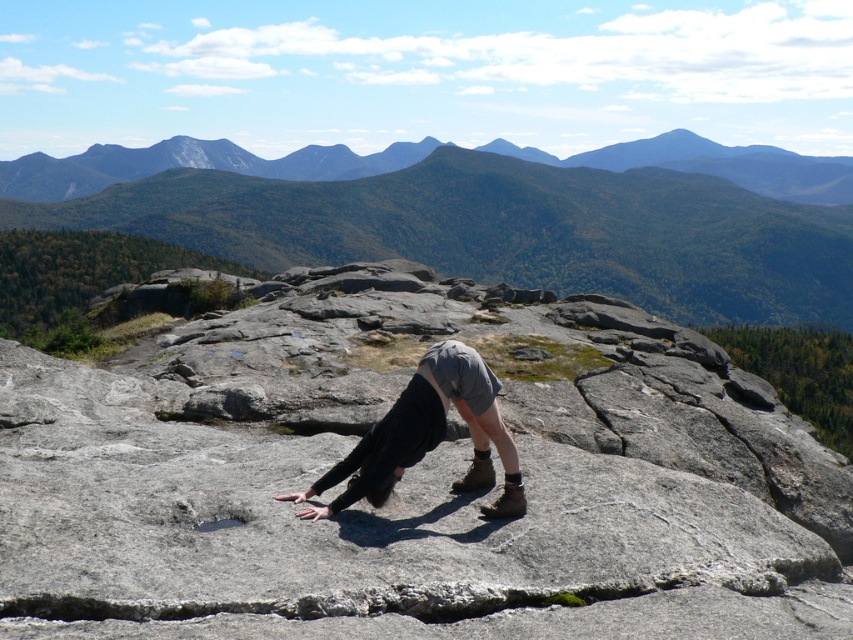
You are a drone operator trying to capture the best aerial shot of the scene. The green grassy mountain at upper center is located at coordinates point 0.348, 0.600. If you want to position your camera to focus on this mountain, which direction should you adjust your drone to move towards?

The green grassy mountain at upper center is located at point (511, 221), so you should move the drone towards the upper center direction to focus on it.

Looking at this image, you are a photographer trying to capture the perfect shot of the gray rock at center. You notice a point marked at coordinates (413, 481) in the image. Based on the scene description, can you determine if this point is located on the gray rock at center?

Yes, the point at coordinates (413, 481) is located on the gray rock at center as described in the Objects Description.

You are a hiker trying to balance on the gray rock at center while looking at the green grassy mountain at upper center. Which object is narrower in width?

The gray rock at center is thinner than the green grassy mountain at upper center, so the gray rock at center is narrower in width.